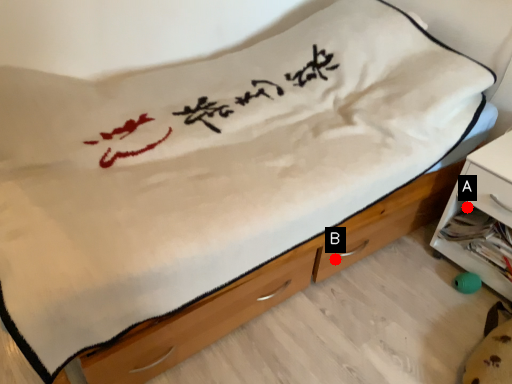
Question: Two points are circled on the image, labeled by A and B beside each circle. Which point is closer to the camera?

Choices:
 (A) A is closer
 (B) B is closer

Answer: (B)